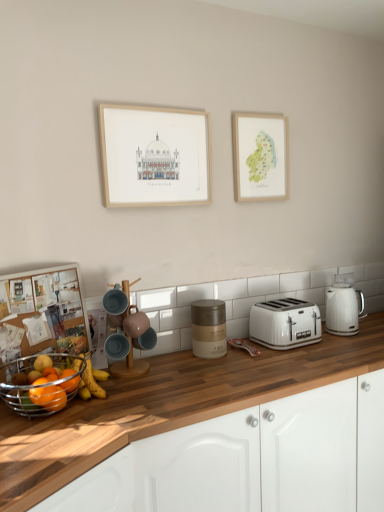
Identify the location of matte ceramic coffee machine at center. (124, 331).

What do you see at coordinates (135, 322) in the screenshot?
I see `matte ceramic mug at center, acting as the 1th appliance starting from the front` at bounding box center [135, 322].

How much space does matte blue mug at center, placed as the first appliance when sorted from left to right, occupy horizontally?

matte blue mug at center, placed as the first appliance when sorted from left to right, is 4.71 inches wide.

What do you see at coordinates (117, 346) in the screenshot? I see `matte blue mug at center, the 4th appliance in the right-to-left sequence` at bounding box center [117, 346].

The width and height of the screenshot is (384, 512). Identify the location of white glossy electric kettle at right, which is the 4th appliance in left-to-right order. (343, 306).

Where is `matte gold canister at center, positioned as the third appliance in left-to-right order`? The image size is (384, 512). matte gold canister at center, positioned as the third appliance in left-to-right order is located at coordinates (208, 328).

What is the approximate height of white plastic toaster at center?

white plastic toaster at center is 18.39 centimeters in height.

Locate an element on the screen. This screenshot has height=512, width=384. matte ceramic coffee machine at center is located at coordinates (124, 331).

From a real-world perspective, who is located higher, white plastic toaster at center or matte ceramic coffee machine at center?

matte ceramic coffee machine at center.

Is white plastic toaster at center turned away from matte ceramic coffee machine at center?

No, matte ceramic coffee machine at center is not at the back of white plastic toaster at center.

Which is more to the right, white plastic toaster at center or matte ceramic coffee machine at center?

white plastic toaster at center is more to the right.

Is white plastic toaster at center not within matte ceramic coffee machine at center?

white plastic toaster at center lies outside matte ceramic coffee machine at center's area.

From the image's perspective, which one is positioned higher, white wood cabinetry at center or white glossy electric kettle at right, which is the 4th appliance in left-to-right order?

white glossy electric kettle at right, which is the 4th appliance in left-to-right order.

Who is taller, white wood cabinetry at center or white glossy electric kettle at right, which ranks as the 1th appliance in back-to-front order?

Standing taller between the two is white wood cabinetry at center.

I want to click on cabinetry below the white glossy electric kettle at right, which ranks as the 1th appliance in back-to-front order (from the image's perspective), so click(x=252, y=459).

What's the angular difference between watercolor paper map at upper right, the first picture frame viewed from the back, and metallic silver fruit basket at lower left's facing directions?

The facing directions of watercolor paper map at upper right, the first picture frame viewed from the back, and metallic silver fruit basket at lower left are 24.7 degrees apart.

Does point (262, 196) come closer to viewer compared to point (5, 382)?

No, it is behind (5, 382).

Is the depth of watercolor paper map at upper right, which is counted as the second picture frame, starting from the left, less than that of metallic silver fruit basket at lower left?

No, watercolor paper map at upper right, which is counted as the second picture frame, starting from the left, is further to the viewer.

From the image's perspective, is watercolor paper map at upper right, the 2th picture frame in the front-to-back sequence, above or below metallic silver fruit basket at lower left?

Based on their image positions, watercolor paper map at upper right, the 2th picture frame in the front-to-back sequence, is located above metallic silver fruit basket at lower left.

Find the location of a particular element. This screenshot has height=512, width=384. basket below the white glossy electric kettle at right, which is the 4th appliance in left-to-right order (from a real-world perspective) is located at coordinates (39, 385).

From a real-world perspective, is white glossy electric kettle at right, which is the 4th appliance in front-to-back order, on metallic silver fruit basket at lower left?

Correct, in the physical world, white glossy electric kettle at right, which is the 4th appliance in front-to-back order, is higher than metallic silver fruit basket at lower left.

Does white glossy electric kettle at right, the 1th appliance in the right-to-left sequence, contain metallic silver fruit basket at lower left?

No, metallic silver fruit basket at lower left is not inside white glossy electric kettle at right, the 1th appliance in the right-to-left sequence.

From the image's perspective, is white glossy electric kettle at right, the 1th appliance in the right-to-left sequence, beneath metallic silver fruit basket at lower left?

No, from the image's perspective, white glossy electric kettle at right, the 1th appliance in the right-to-left sequence, is not below metallic silver fruit basket at lower left.

Looking at the image, does matte blue mug at center, the 4th appliance in the right-to-left sequence, seem bigger or smaller compared to metallic silver fruit basket at lower left?

Considering their sizes, matte blue mug at center, the 4th appliance in the right-to-left sequence, takes up less space than metallic silver fruit basket at lower left.

Is the position of matte blue mug at center, the 4th appliance in the right-to-left sequence, less distant than that of metallic silver fruit basket at lower left?

No, it is not.

From the image's perspective, which is below, matte blue mug at center, the 2th appliance positioned from the front, or metallic silver fruit basket at lower left?

metallic silver fruit basket at lower left appears lower in the image.

Considering the sizes of objects white wood cabinetry at center and matte gold canister at center, placed as the third appliance when sorted from front to back, in the image provided, who is shorter, white wood cabinetry at center or matte gold canister at center, placed as the third appliance when sorted from front to back,?

Standing shorter between the two is matte gold canister at center, placed as the third appliance when sorted from front to back.

Considering the positions of objects white wood cabinetry at center and matte gold canister at center, which is the second appliance in back-to-front order, in the image provided, who is more to the left, white wood cabinetry at center or matte gold canister at center, which is the second appliance in back-to-front order,?

From the viewer's perspective, matte gold canister at center, which is the second appliance in back-to-front order, appears more on the left side.

Does white wood cabinetry at center lie in front of matte gold canister at center, which is the second appliance in back-to-front order?

Yes, it is in front of matte gold canister at center, which is the second appliance in back-to-front order.

Looking at this image, does white wood cabinetry at center have a larger size compared to matte gold canister at center, placed as the third appliance when sorted from front to back?

Yes.

Can you confirm if white plastic toaster at center is thinner than metallic silver fruit basket at lower left?

Yes.

Considering the relative positions of white plastic toaster at center and metallic silver fruit basket at lower left in the image provided, is white plastic toaster at center to the left of metallic silver fruit basket at lower left from the viewer's perspective?

No.

Can you confirm if white plastic toaster at center is taller than metallic silver fruit basket at lower left?

Yes.

How different are the orientations of white plastic toaster at center and metallic silver fruit basket at lower left in degrees?

23 degrees.

This screenshot has height=512, width=384. I want to click on coffee machine in front of the white plastic toaster at center, so click(124, 331).

The image size is (384, 512). Find the location of `cabinetry that is on the left side of white glossy electric kettle at right, the 1th appliance in the right-to-left sequence`. cabinetry that is on the left side of white glossy electric kettle at right, the 1th appliance in the right-to-left sequence is located at coordinates (252, 459).

Estimate the real-world distances between objects in this image. Which object is further from matte gold canister at center, placed as the third appliance when sorted from front to back, matte blue mug at center, the 2th appliance positioned from the front, or matte ceramic coffee machine at center?

matte blue mug at center, the 2th appliance positioned from the front, is further to matte gold canister at center, placed as the third appliance when sorted from front to back.

When comparing their distances from white glossy electric kettle at right, which is the 4th appliance in left-to-right order, does white plastic toaster at center or matte gold canister at center, positioned as the third appliance in left-to-right order, seem further?

Based on the image, matte gold canister at center, positioned as the third appliance in left-to-right order, appears to be further to white glossy electric kettle at right, which is the 4th appliance in left-to-right order.

Which object lies nearer to the anchor point matte ceramic mug at center, which appears as the second appliance when viewed from the left, white plastic toaster at center or matte gold canister at center, the 2th appliance viewed from the right?

Among the two, matte gold canister at center, the 2th appliance viewed from the right, is located nearer to matte ceramic mug at center, which appears as the second appliance when viewed from the left.

Based on their spatial positions, is white wood cabinetry at center or matte ceramic coffee machine at center closer to watercolor paper map at upper right, the first picture frame viewed from the back?

The object closer to watercolor paper map at upper right, the first picture frame viewed from the back, is matte ceramic coffee machine at center.

Considering their positions, is white plastic toaster at center positioned further to metallic silver fruit basket at lower left than matte wooden picture frame at upper center, placed as the first picture frame when sorted from front to back?

white plastic toaster at center is positioned further to the anchor metallic silver fruit basket at lower left.

Estimate the real-world distances between objects in this image. Which object is closer to white plastic toaster at center, watercolor paper map at upper right, which is counted as the second picture frame, starting from the left, or matte ceramic coffee machine at center?

The object closer to white plastic toaster at center is matte ceramic coffee machine at center.

Considering their positions, is white wood cabinetry at center positioned closer to white plastic toaster at center than matte gold canister at center, which is the second appliance in back-to-front order?

matte gold canister at center, which is the second appliance in back-to-front order, is positioned closer to the anchor white plastic toaster at center.

Looking at this image, from the image, which object appears to be farther from matte wooden picture frame at upper center, placed as the second picture frame when sorted from right to left, matte blue mug at center, the 4th appliance in the right-to-left sequence, or white glossy electric kettle at right, the 1th appliance in the right-to-left sequence?

Among the two, white glossy electric kettle at right, the 1th appliance in the right-to-left sequence, is located further to matte wooden picture frame at upper center, placed as the second picture frame when sorted from right to left.

Where is `coffee machine between watercolor paper map at upper right, which is counted as the second picture frame, starting from the left, and matte gold canister at center, positioned as the third appliance in left-to-right order, in the vertical direction`? The height and width of the screenshot is (512, 384). coffee machine between watercolor paper map at upper right, which is counted as the second picture frame, starting from the left, and matte gold canister at center, positioned as the third appliance in left-to-right order, in the vertical direction is located at coordinates (124, 331).

This screenshot has height=512, width=384. I want to click on basket between matte wooden picture frame at upper center, placed as the second picture frame when sorted from right to left, and white wood cabinetry at center from top to bottom, so click(x=39, y=385).

I want to click on coffee machine that lies between watercolor paper map at upper right, which is counted as the second picture frame, starting from the left, and white wood cabinetry at center from top to bottom, so click(124, 331).

You are a GUI agent. You are given a task and a screenshot of the screen. Output one action in this format:
    pyautogui.click(x=<x>, y=<y>)
    Task: Click on the coffee machine between watercolor paper map at upper right, which is counted as the second picture frame, starting from the left, and white plastic toaster at center from top to bottom
    The height and width of the screenshot is (512, 384).
    Given the screenshot: What is the action you would take?
    pyautogui.click(x=124, y=331)